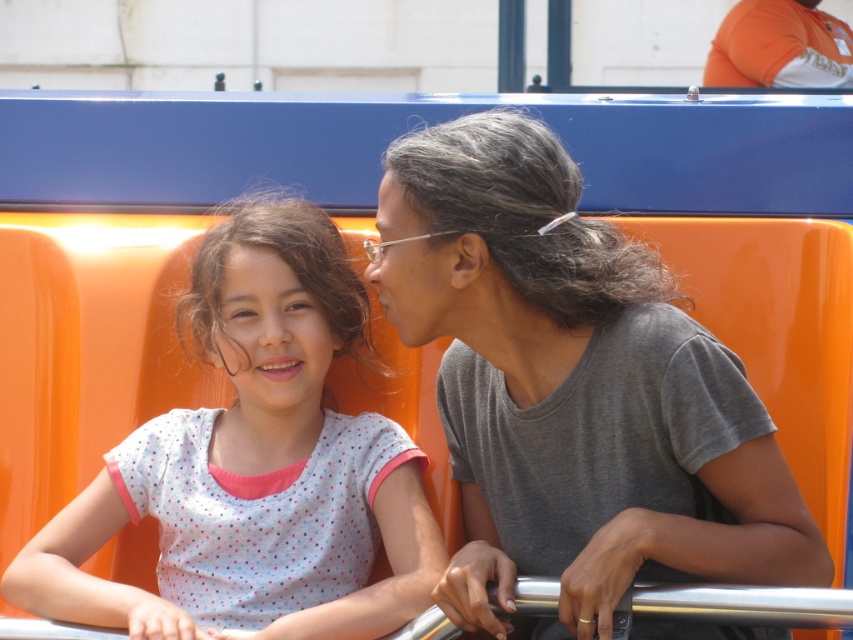
You are standing in front of the ride and see the gray matte hair at center. Can you reach out and touch it with your hand?

The gray matte hair at center and viewer are 7.20 feet apart from each other, so no, you cannot reach out and touch it with your hand since it is too far away.

From the picture: You are designing a new seat for the amusement park ride shown. The seat must accommodate both the gray matte hair at center and the white dotted shirt at center. Based on their widths, which object requires more space in the seat design?

The white dotted shirt at center requires more space in the seat design because it has a greater width than the gray matte hair at center according to the description.

You are a photographer trying to capture the perfect shot of the gray matte hair at center. Given that the camera is focused on the point at coordinates (573,388), will this point be the center of the image?

The point at coordinates (573,388) corresponds to the gray matte hair at center, so yes, this point will be the center of the image.